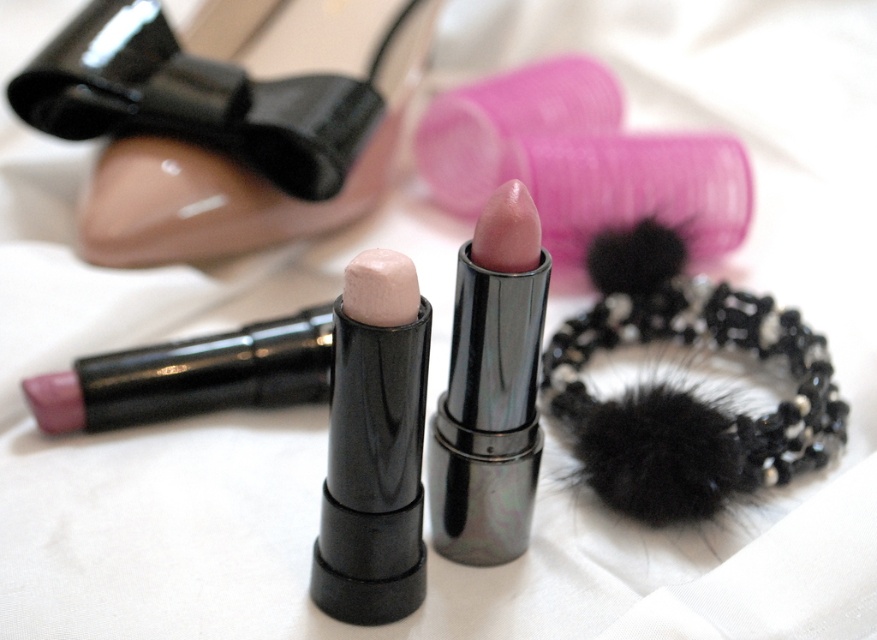
Question: Is shiny metallic lipstick at center smaller than matte pink lipstick at center?

Choices:
 (A) no
 (B) yes

Answer: (A)

Question: Which point appears closest to the camera in this image?

Choices:
 (A) (498, 218)
 (B) (371, 468)

Answer: (A)

Question: Which object is positioned farthest from the pearlized matte highlighter at center?

Choices:
 (A) matte pink lipstick at center
 (B) shiny metallic lipstick at center

Answer: (A)

Question: Does glossy plastic shoe at upper left have a smaller size compared to pearlized matte highlighter at center?

Choices:
 (A) yes
 (B) no

Answer: (B)

Question: Does glossy plastic shoe at upper left appear on the right side of pearlized matte highlighter at center?

Choices:
 (A) no
 (B) yes

Answer: (A)

Question: Which of these objects is positioned farthest from the matte pink lipstick at center?

Choices:
 (A) pearlized matte highlighter at center
 (B) glossy plastic shoe at upper left
 (C) shiny metallic lipstick at center

Answer: (A)